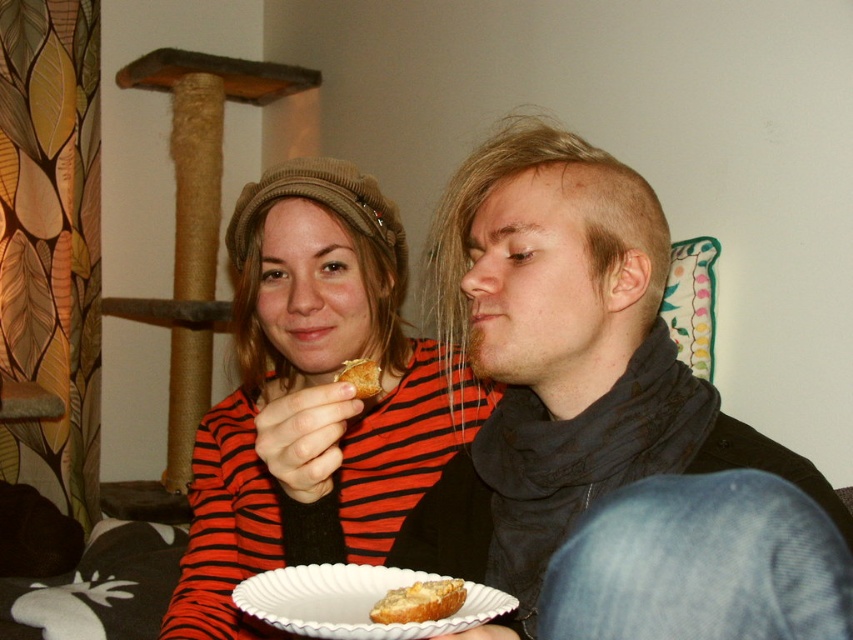
Question: Which point appears closest to the camera in this image?

Choices:
 (A) (331, 477)
 (B) (341, 371)
 (C) (263, 589)

Answer: (C)

Question: Is black matte scarf at center further to the viewer compared to white paper plate at lower center?

Choices:
 (A) yes
 (B) no

Answer: (A)

Question: Which point is closer to the camera taking this photo?

Choices:
 (A) (263, 547)
 (B) (343, 364)

Answer: (B)

Question: Which object appears farthest from the camera in this image?

Choices:
 (A) striped fabric sweater at center
 (B) golden brown bread at lower center
 (C) golden crumbly pastry at center

Answer: (C)

Question: Is black matte scarf at center to the left of golden brown bread at lower center from the viewer's perspective?

Choices:
 (A) no
 (B) yes

Answer: (A)

Question: Observing the image, what is the correct spatial positioning of white paper plate at lower center in reference to golden crumbly pastry at center?

Choices:
 (A) left
 (B) right

Answer: (B)